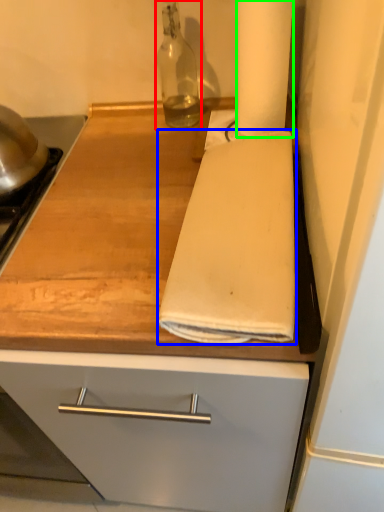
Question: Which is farther away from bottle (highlighted by a red box)? bath towel (highlighted by a blue box) or paper towel (highlighted by a green box)?

Choices:
 (A) bath towel
 (B) paper towel

Answer: (A)